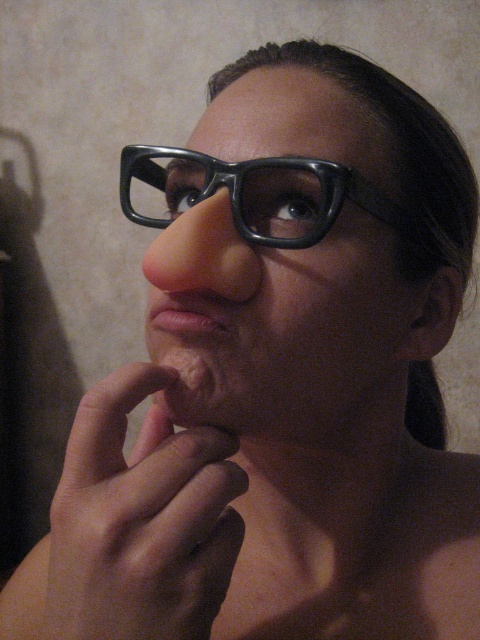
You are a photographer adjusting the focus on a camera. You need to ensure that both the smooth skin hand at center and the matte pink lips at center are in focus. Given their sizes, which object should you adjust the focus towards first to capture both clearly?

The smooth skin hand at center is bigger than the matte pink lips at center, so you should focus on the smooth skin hand at center first since larger objects often require precise focus adjustments to ensure clarity, allowing the smaller matte pink lips at center to remain in focus as well.

You are a photographer adjusting the lighting in the studio. You need to ensure that the smooth skin hand at center and the matte pink lips at center are both clearly visible. Given their sizes, which object should you focus on first to adjust the lighting properly?

The smooth skin hand at center is taller than matte pink lips at center, so you should focus on adjusting the lighting for the smooth skin hand at center first since it is larger and might require more attention to ensure proper visibility.

You are taking a photo of a person with a camera that can only focus on objects at the same distance from the camera. You notice two points in the image labeled as point [262,195] and point [168,320]. Can you focus on both points at the same time?

Point [262,195] is further to the camera than point [168,320]. Since they are at different distances, the camera cannot focus on both points simultaneously.